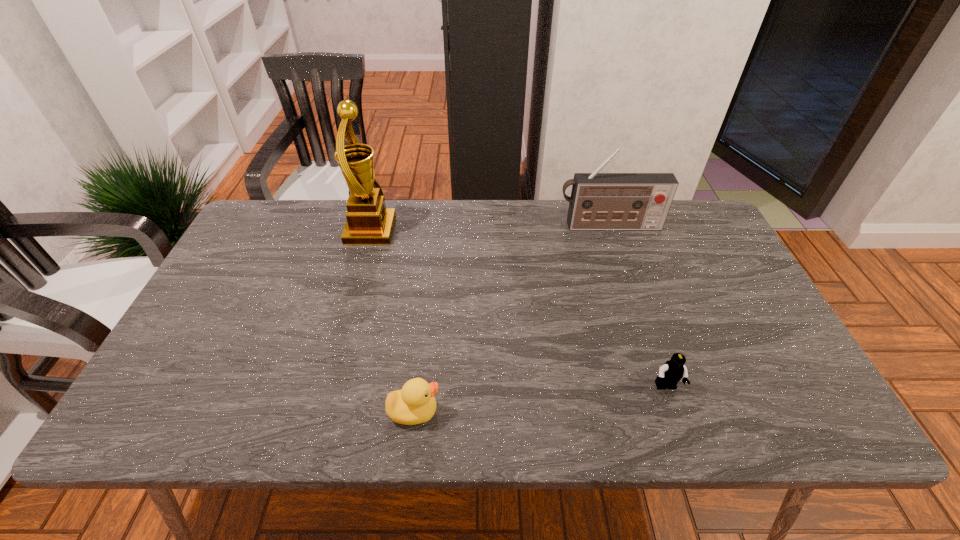
Find the location of a particular element. radio receiver that is at the far edge is located at coordinates (599, 201).

I want to click on object located at the near edge, so click(415, 403).

Locate an element on the screen. object situated at the right edge is located at coordinates [599, 201].

This screenshot has width=960, height=540. Identify the location of object that is at the far right corner. (599, 201).

The image size is (960, 540). In the image, there is a desktop. Find the location of `vacant region at the far edge`. vacant region at the far edge is located at coordinates (538, 241).

The height and width of the screenshot is (540, 960). In the image, there is a desktop. Find the location of `vacant space at the near edge`. vacant space at the near edge is located at coordinates (577, 429).

This screenshot has width=960, height=540. In the image, there is a desktop. Identify the location of free region at the right edge. (747, 382).

Find the location of a particular element. The width and height of the screenshot is (960, 540). vacant space at the far left corner is located at coordinates (268, 233).

What are the coordinates of `vacant space at the near right corner of the desktop` in the screenshot? It's located at (788, 411).

Locate an element on the screen. The width and height of the screenshot is (960, 540). vacant space that's between the tallest object and the Lego is located at coordinates (518, 309).